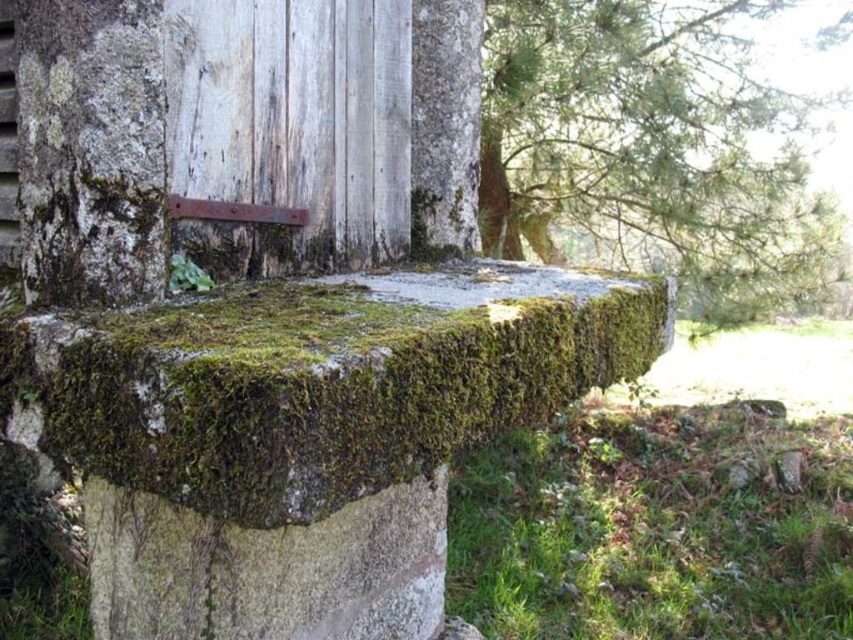
Does green mossy stone at center have a greater width compared to green mossy stump at upper right?

Incorrect, green mossy stone at center's width does not surpass green mossy stump at upper right's.

Is green mossy stone at center closer to camera compared to green mossy stump at upper right?

Yes, green mossy stone at center is in front of green mossy stump at upper right.

The image size is (853, 640). I want to click on green mossy stone at center, so click(x=318, y=381).

This screenshot has height=640, width=853. What are the coordinates of `green mossy stone at center` in the screenshot? It's located at (318, 381).

Does green mossy grass at lower right have a lesser height compared to green mossy stump at upper right?

Indeed, green mossy grass at lower right has a lesser height compared to green mossy stump at upper right.

Between green mossy grass at lower right and green mossy stump at upper right, which one is positioned higher?

green mossy stump at upper right is higher up.

Is point (654, 628) closer to viewer compared to point (689, 237)?

Yes, it is.

Locate an element on the screen. green mossy grass at lower right is located at coordinates (656, 528).

Between green mossy stone at center and green mossy grass at lower right, which one appears on the left side from the viewer's perspective?

green mossy stone at center is more to the left.

The height and width of the screenshot is (640, 853). Find the location of `green mossy stone at center`. green mossy stone at center is located at coordinates (318, 381).